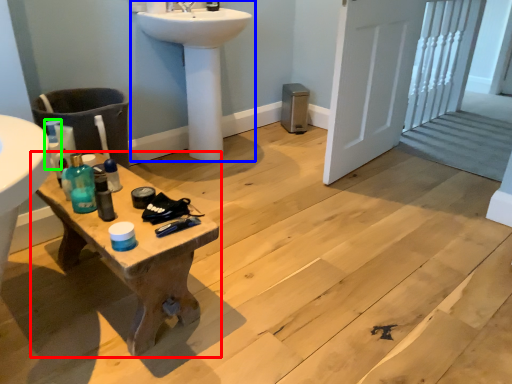
Question: Estimate the real-world distances between objects in this image. Which object is closer to table (highlighted by a red box), sink (highlighted by a blue box) or bottle (highlighted by a green box)?

Choices:
 (A) sink
 (B) bottle

Answer: (B)